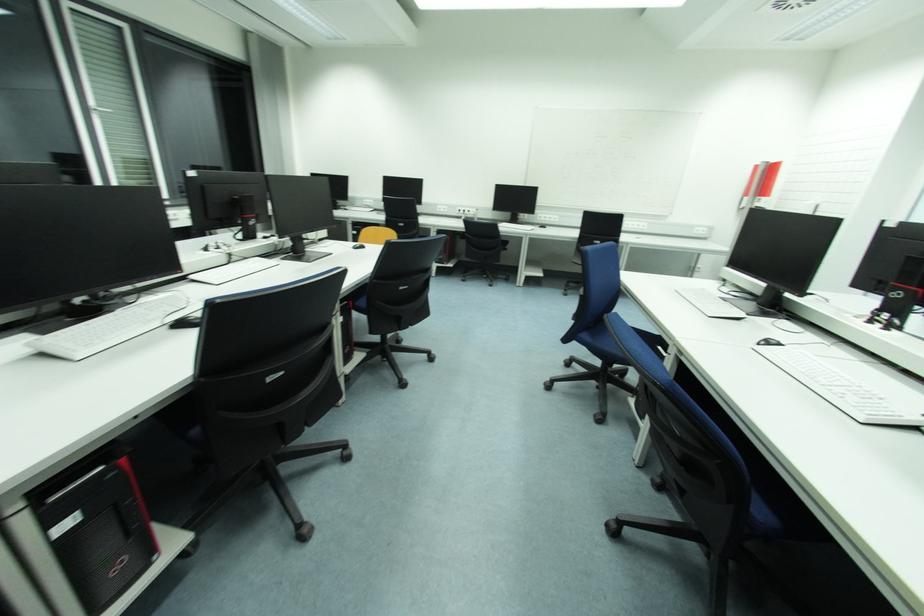
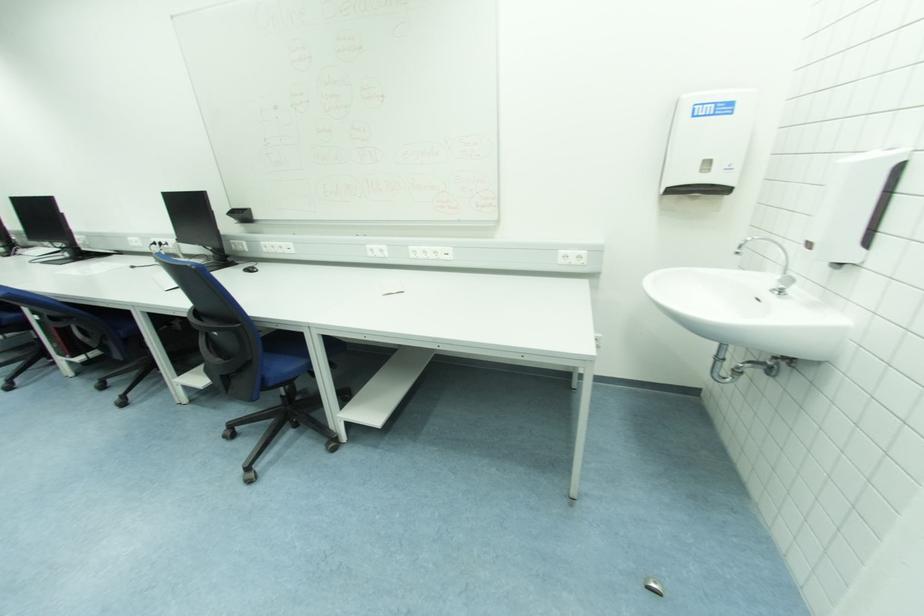
The images are taken continuously from a first-person perspective. In which direction are you moving?

The movement direction of the cameraman is right, forward.